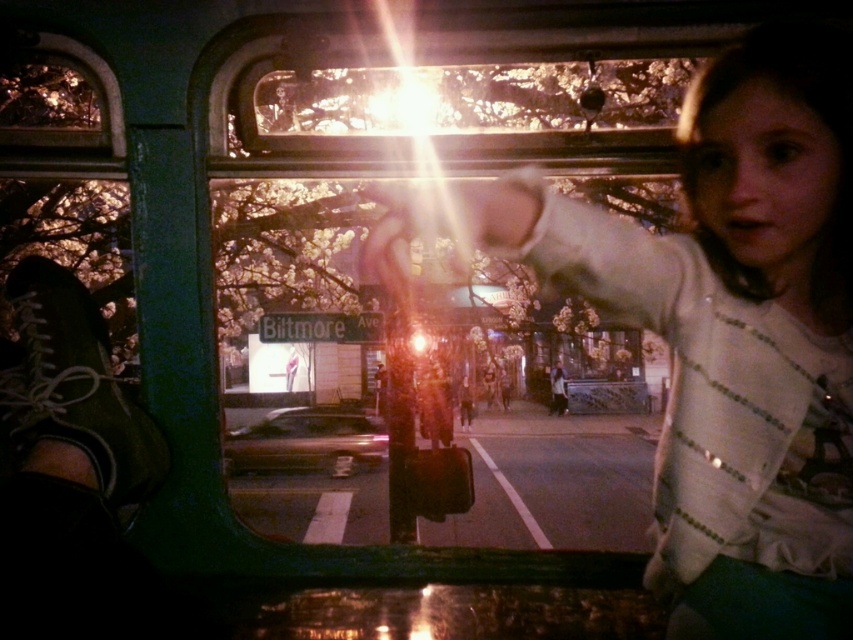
Which of these two, white cotton shirt at center or smooth leather jacket at center, stands shorter?

smooth leather jacket at center

Where is `white cotton shirt at center`? This screenshot has width=853, height=640. white cotton shirt at center is located at coordinates (556, 390).

Find the location of `white cotton shirt at center`. white cotton shirt at center is located at coordinates (556, 390).

Where is `white cotton shirt at center`? Image resolution: width=853 pixels, height=640 pixels. white cotton shirt at center is located at coordinates pos(556,390).

In the scene shown: Is matte white shirt at center below shiny metallic car at center?

Incorrect, matte white shirt at center is not positioned below shiny metallic car at center.

Can you confirm if matte white shirt at center is bigger than shiny metallic car at center?

Yes, matte white shirt at center is bigger than shiny metallic car at center.

What do you see at coordinates (734, 333) in the screenshot?
I see `matte white shirt at center` at bounding box center [734, 333].

Locate an element on the screen. The width and height of the screenshot is (853, 640). matte white shirt at center is located at coordinates (734, 333).

Is matte white shirt at center wider than smooth leather jacket at center?

Yes, matte white shirt at center is wider than smooth leather jacket at center.

Does point (805, 61) come closer to viewer compared to point (462, 413)?

Yes, point (805, 61) is in front of point (462, 413).

Is point (608, 253) positioned behind point (463, 419)?

No, it is not.

Find the location of a particular element. matte white shirt at center is located at coordinates (734, 333).